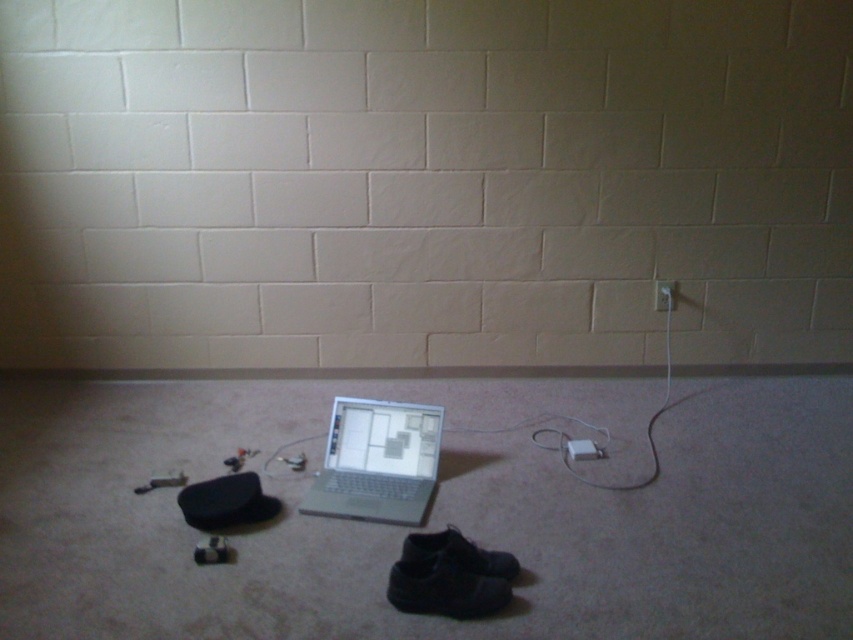
You are a technician trying to reach the white plastic plug at lower center from your current position. The room has a dimly lit environment with a concrete block wall in the background. You have a 2.5 meter extension cord. Can you safely extend the cable to reach the plug without moving your current position?

The white plastic plug at lower center is 2.83 meters away from the camera. Since the extension cord is only 2.5 meters long, it is not long enough to reach the plug without moving your position.

Based on the photo, you are trying to unplug the white plastic plug at lower center from the white plastic electric outlet at upper right. Which direction should you move the plug to disconnect it?

The white plastic plug at lower center is positioned on the left side of the white plastic electric outlet at upper right, so you should move it to the left to disconnect it.

You are standing in the room depicted in the image. You need to reach the electrical outlet on the wall to unplug the laptop. The outlet is located at point (376, 461). Is the laptop currently plugged into this outlet?

The silver metallic laptop at center is located at point (376, 461), which is where the electrical outlet is. Therefore, the laptop is plugged into this outlet.